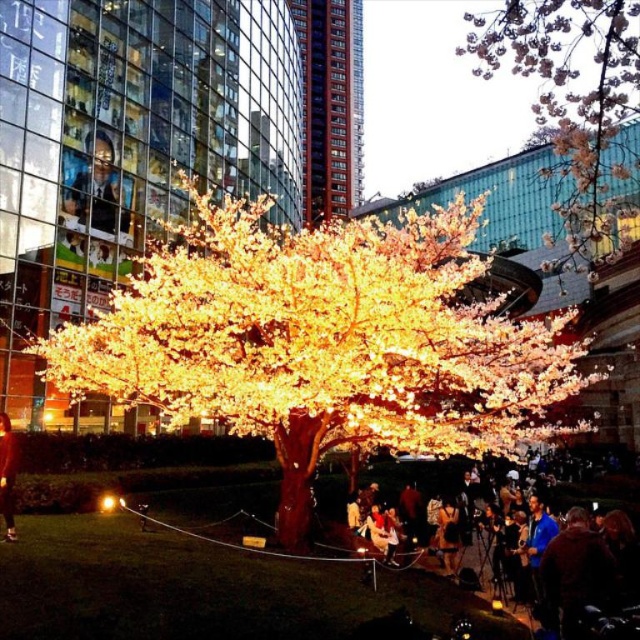
This screenshot has width=640, height=640. Describe the element at coordinates (323, 340) in the screenshot. I see `illuminated plastic tree at center` at that location.

Does illuminated plastic tree at center appear over smooth glass portrait at upper left?

Actually, illuminated plastic tree at center is below smooth glass portrait at upper left.

Does point (451, 339) come farther from viewer compared to point (76, 205)?

No, (451, 339) is in front of (76, 205).

What are the coordinates of `illuminated plastic tree at center` in the screenshot? It's located at (323, 340).

Who is more distant from viewer, (x=621, y=64) or (x=10, y=477)?

The point (x=621, y=64) is behind.

Locate an element on the screen. pink blossoms at upper right is located at coordinates [x=570, y=88].

Which is below, pink blossoms at upper right or matte black jacket at lower right?

matte black jacket at lower right is below.

Looking at this image, does pink blossoms at upper right have a greater height compared to matte black jacket at lower right?

Yes.

Measure the distance between pink blossoms at upper right and camera.

The distance of pink blossoms at upper right from camera is 34.33 meters.

Where is `pink blossoms at upper right`? Image resolution: width=640 pixels, height=640 pixels. pink blossoms at upper right is located at coordinates (570, 88).